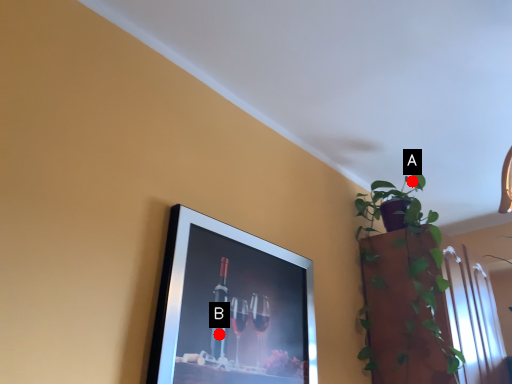
Question: Two points are circled on the image, labeled by A and B beside each circle. Which point is further to the camera?

Choices:
 (A) A is further
 (B) B is further

Answer: (A)